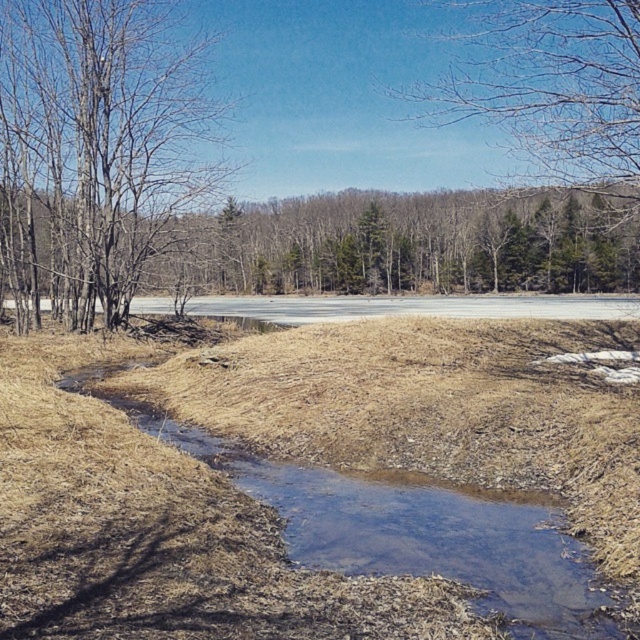
You are standing at the center of the image and want to walk towards the bare branches at left. In which direction should you head?

You should head to the left since the bare branches at left are located at the left side of the image.

You are standing at the edge of the stream in the foreground and want to walk towards the point marked as point (572, 556). Will you pass through the area where point (196, 77) is located?

No, because point (196, 77) is closer to you than point (572, 556), so you would reach point (572, 556) without passing through point (196, 77).

Consider the image. You are standing at the point with coordinates point (577,67) and want to walk towards the point with coordinates point (452,506). Based on the scene description, will you be moving towards or away from the stream?

Point (452,506) is in front of point (577,67), so moving towards it means you are moving towards the stream.